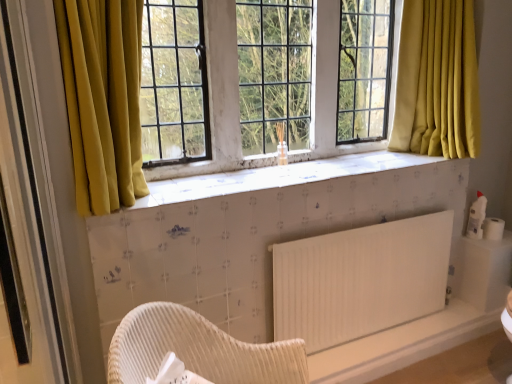
The width and height of the screenshot is (512, 384). What do you see at coordinates (219, 101) in the screenshot? I see `matte glass window screen at center` at bounding box center [219, 101].

Locate an element on the screen. This screenshot has height=384, width=512. matte glass window screen at center is located at coordinates (x=219, y=101).

The height and width of the screenshot is (384, 512). I want to click on white textured tile at center, so click(277, 177).

Where is `white matte radiator at lower right`? Image resolution: width=512 pixels, height=384 pixels. white matte radiator at lower right is located at coordinates (360, 280).

Who is shorter, white textured tile at center or matte glass window screen at center?

white textured tile at center.

Which of these two, white textured tile at center or matte glass window screen at center, is smaller?

Smaller between the two is white textured tile at center.

Is white textured tile at center aimed at matte glass window screen at center?

No, white textured tile at center is not facing towards matte glass window screen at center.

Would you consider matte glass window screen at center to be distant from white matte toilet paper at right?

Indeed, matte glass window screen at center is not near white matte toilet paper at right.

In terms of width, does matte glass window screen at center look wider or thinner when compared to white matte toilet paper at right?

matte glass window screen at center is wider than white matte toilet paper at right.

Is matte glass window screen at center closer to the viewer compared to white matte toilet paper at right?

Yes, it is in front of white matte toilet paper at right.

From a real-world perspective, is white textured tile at center on top of white matte toilet paper at right?

Yes, from a real-world perspective, white textured tile at center is on top of white matte toilet paper at right.

Based on the photo, is white textured tile at center further to camera compared to white matte toilet paper at right?

Result: That is False.

Does white textured tile at center have a lesser height compared to white matte toilet paper at right?

Correct, white textured tile at center is not as tall as white matte toilet paper at right.

Is point (272, 182) positioned in front of point (498, 224)?

Yes, it is in front of point (498, 224).

Is woven wood chair at lower center turned away from white textured tile at center?

No, woven wood chair at lower center is not facing away from white textured tile at center.

Which object is wider, woven wood chair at lower center or white textured tile at center?

woven wood chair at lower center is wider.

From a real-world perspective, is woven wood chair at lower center above or below white textured tile at center?

woven wood chair at lower center is situated lower than white textured tile at center in the real world.

Measure the distance from woven wood chair at lower center to white textured tile at center.

25.85 inches.

Who is smaller, matte glass window screen at center or white textured tile at center?

Smaller between the two is white textured tile at center.

Are matte glass window screen at center and white textured tile at center beside each other?

There is a gap between matte glass window screen at center and white textured tile at center.

Is matte glass window screen at center positioned before white textured tile at center?

No, matte glass window screen at center is further to the viewer.

Is white matte radiator at lower right a part of woven wood chair at lower center?

No, white matte radiator at lower right is not surrounded by woven wood chair at lower center.

Does point (198, 329) lie in front of point (367, 319)?

Yes, point (198, 329) is closer to viewer.

Based on the photo, considering the relative positions of white textured tile at center and white matte radiator at lower right in the image provided, is white textured tile at center to the left of white matte radiator at lower right from the viewer's perspective?

Correct, you'll find white textured tile at center to the left of white matte radiator at lower right.

Can we say white textured tile at center lies outside white matte radiator at lower right?

Yes, white textured tile at center is outside of white matte radiator at lower right.

Which is less distant, (376, 152) or (331, 249)?

The point (331, 249) is closer to the camera.

Identify the location of window sill lying below the matte glass window screen at center (from the image's perspective). This screenshot has height=384, width=512. (277, 177).

This screenshot has width=512, height=384. I want to click on window screen above the white matte toilet paper at right (from a real-world perspective), so click(x=219, y=101).

Estimate the real-world distances between objects in this image. Which object is further from white matte toilet paper at right, woven wood chair at lower center or white matte radiator at lower right?

The object further to white matte toilet paper at right is woven wood chair at lower center.

When comparing their distances from white matte radiator at lower right, does white textured tile at center or matte glass window screen at center seem closer?

white textured tile at center.

Consider the image. From the image, which object appears to be nearer to white matte toilet paper at right, white textured tile at center or white matte radiator at lower right?

The object closer to white matte toilet paper at right is white matte radiator at lower right.

Which object lies further to the anchor point white matte radiator at lower right, woven wood chair at lower center or white matte toilet paper at right?

white matte toilet paper at right.

Considering their positions, is white matte toilet paper at right positioned closer to white matte radiator at lower right than woven wood chair at lower center?

woven wood chair at lower center.

Looking at the image, which one is located closer to white matte toilet paper at right, white textured tile at center or woven wood chair at lower center?

The object closer to white matte toilet paper at right is white textured tile at center.

Based on their spatial positions, is white matte radiator at lower right or matte glass window screen at center further from white matte toilet paper at right?

matte glass window screen at center is positioned further to the anchor white matte toilet paper at right.

In the scene shown: Estimate the real-world distances between objects in this image. Which object is closer to matte glass window screen at center, woven wood chair at lower center or white matte radiator at lower right?

The object closer to matte glass window screen at center is white matte radiator at lower right.

Where is `window sill between woven wood chair at lower center and white matte radiator at lower right along the z-axis`? This screenshot has height=384, width=512. window sill between woven wood chair at lower center and white matte radiator at lower right along the z-axis is located at coordinates (277, 177).

The width and height of the screenshot is (512, 384). Identify the location of radiator between white textured tile at center and white matte toilet paper at right. (360, 280).

This screenshot has width=512, height=384. Find the location of `window sill between matte glass window screen at center and white matte radiator at lower right vertically`. window sill between matte glass window screen at center and white matte radiator at lower right vertically is located at coordinates (277, 177).

You are a GUI agent. You are given a task and a screenshot of the screen. Output one action in this format:
    pyautogui.click(x=<x>, y=<y>)
    Task: Click on the radiator located between woven wood chair at lower center and white matte toilet paper at right in the left-right direction
    This screenshot has width=512, height=384.
    Given the screenshot: What is the action you would take?
    pyautogui.click(x=360, y=280)